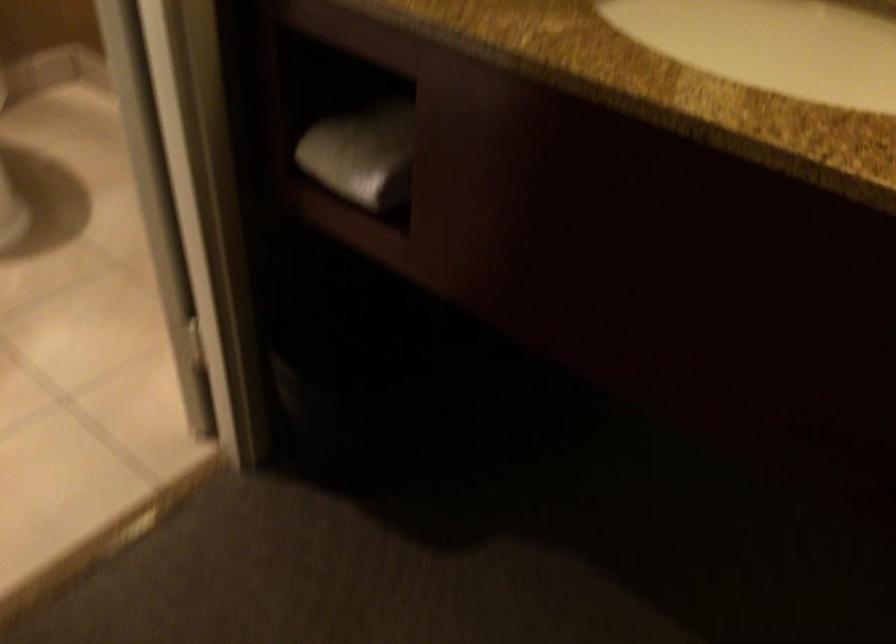
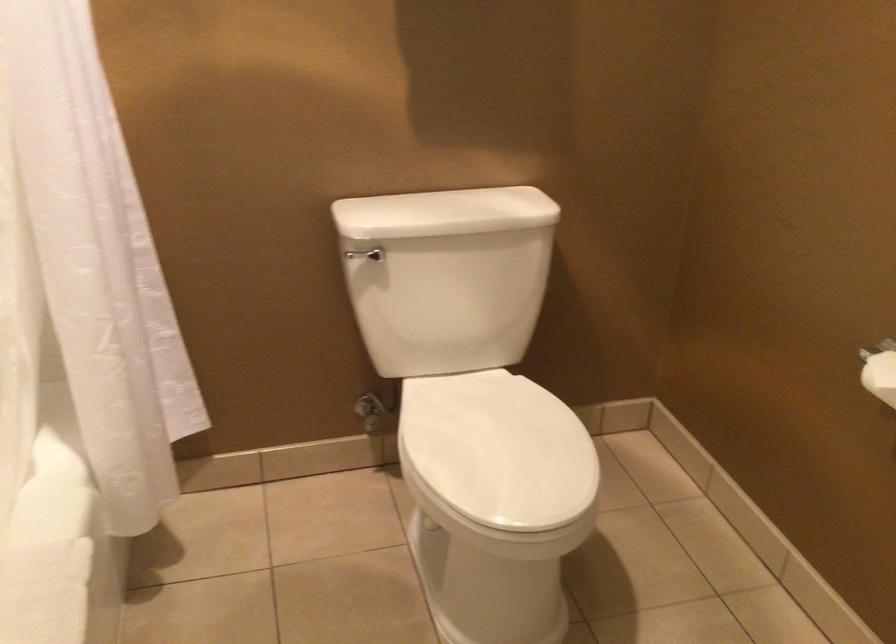
Question: The images are taken continuously from a first-person perspective. In which direction is your viewpoint rotating?

Choices:
 (A) Left
 (B) Right
 (C) Up
 (D) Down

Answer: (A)